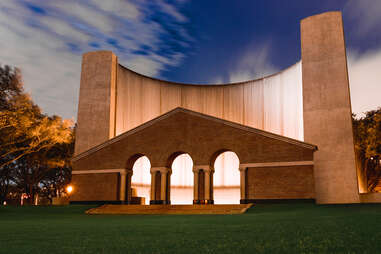
Locate an element on the screen. light is located at coordinates (57, 183).